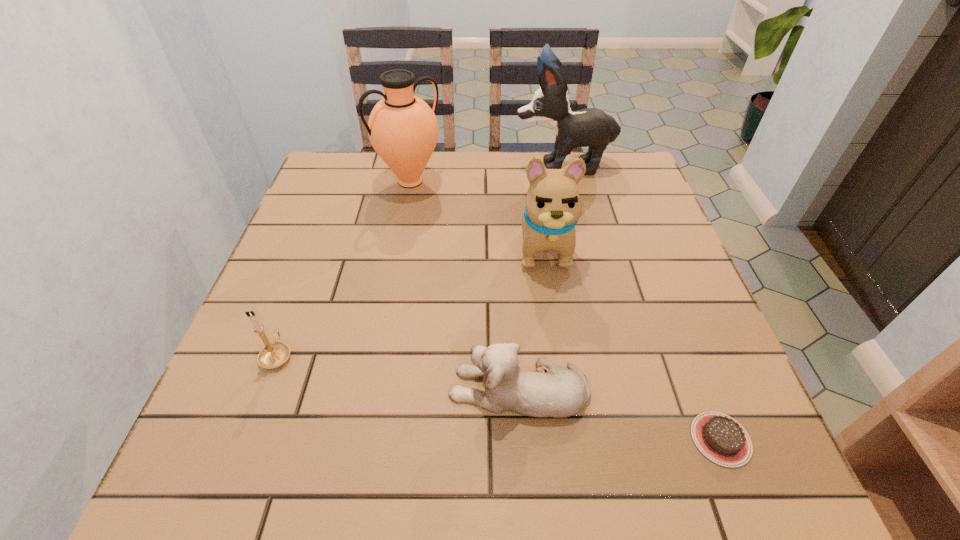
In order to click on pitcher that is at the far edge in this screenshot , I will do `click(402, 128)`.

At what (x,y) coordinates should I click in order to perform the action: click on object at the near edge. Please return your answer as a coordinate pair (x, y). Looking at the image, I should click on click(x=720, y=438).

Where is `object that is at the left edge`? object that is at the left edge is located at coordinates (273, 355).

The width and height of the screenshot is (960, 540). Find the location of `puppy at the right edge`. puppy at the right edge is located at coordinates (591, 127).

Locate an element on the screen. The width and height of the screenshot is (960, 540). chocolate cake that is at the right edge is located at coordinates (720, 438).

This screenshot has height=540, width=960. Identify the location of object present at the far right corner. (591, 127).

The width and height of the screenshot is (960, 540). Identify the location of object present at the near right corner. (720, 438).

Where is `free region at the far edge of the desktop`? The image size is (960, 540). free region at the far edge of the desktop is located at coordinates (520, 186).

What are the coordinates of `vacant point at the near edge` in the screenshot? It's located at (328, 455).

I want to click on vacant space at the left edge of the desktop, so click(324, 277).